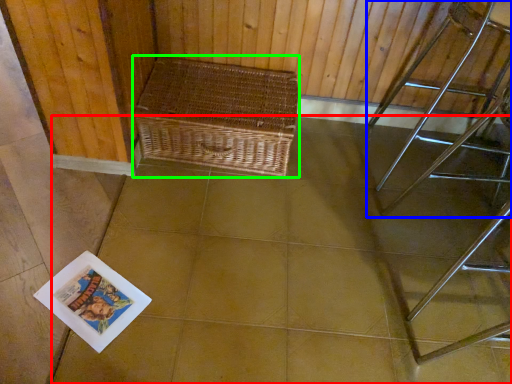
Question: Which is nearer to the square (highlighted by a red box)? furniture (highlighted by a blue box) or picnic basket (highlighted by a green box).

Choices:
 (A) furniture
 (B) picnic basket

Answer: (B)